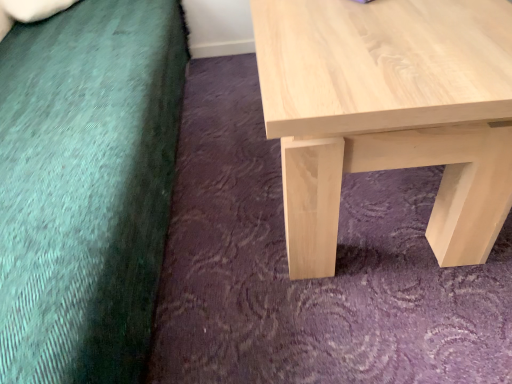
The height and width of the screenshot is (384, 512). What do you see at coordinates (86, 187) in the screenshot?
I see `teal fabric bed at left` at bounding box center [86, 187].

Where is `teal fabric bed at left`? The height and width of the screenshot is (384, 512). teal fabric bed at left is located at coordinates (86, 187).

Locate an element on the screen. teal fabric bed at left is located at coordinates (86, 187).